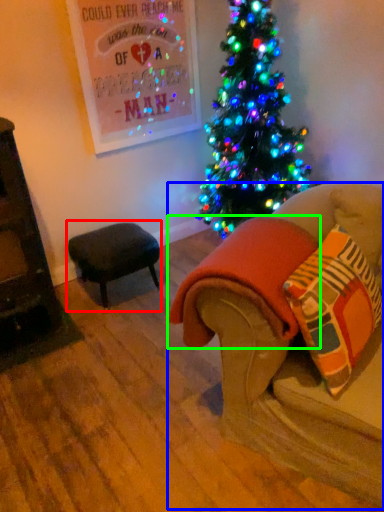
Question: Considering the real-world distances, which object is closest to table (highlighted by a red box)? studio couch (highlighted by a blue box) or blanket (highlighted by a green box).

Choices:
 (A) studio couch
 (B) blanket

Answer: (B)